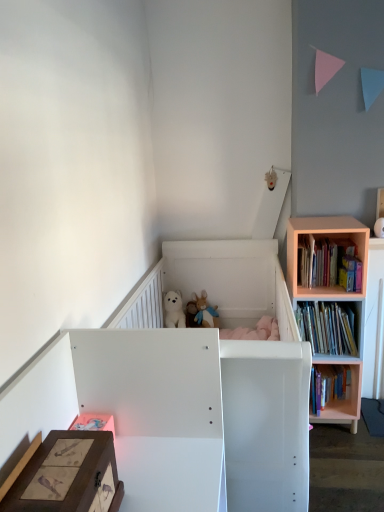
Question: Does matte white vase at upper right, which is the 1th toy from right to left, have a greater width compared to hardcover book at right, the 1th book from the bottom?

Choices:
 (A) yes
 (B) no

Answer: (B)

Question: Is matte white vase at upper right, the first toy from the front, shorter than hardcover book at right, arranged as the third book when viewed from the top?

Choices:
 (A) yes
 (B) no

Answer: (A)

Question: Is matte white vase at upper right, which ranks as the 1th toy in top-to-bottom order, not near hardcover book at right, the 1th book from the bottom?

Choices:
 (A) yes
 (B) no

Answer: (B)

Question: Is matte white vase at upper right, which ranks as the 1th toy in top-to-bottom order, outside of hardcover book at right, the 1th book from the bottom?

Choices:
 (A) no
 (B) yes

Answer: (B)

Question: From the image's perspective, is matte white vase at upper right, positioned as the second toy in bottom-to-top order, below hardcover book at right, arranged as the third book when viewed from the top?

Choices:
 (A) yes
 (B) no

Answer: (B)

Question: Is white matte infant bed at center in front of or behind white plush bear at upper center in the image?

Choices:
 (A) front
 (B) behind

Answer: (A)

Question: Looking at their shapes, would you say white matte infant bed at center is wider or thinner than white plush bear at upper center?

Choices:
 (A) thin
 (B) wide

Answer: (B)

Question: Visually, is white matte infant bed at center positioned to the left or to the right of white plush bear at upper center?

Choices:
 (A) left
 (B) right

Answer: (B)

Question: From a real-world perspective, relative to white plush bear at upper center, is white matte infant bed at center vertically above or below?

Choices:
 (A) below
 (B) above

Answer: (A)

Question: Relative to matte white vase at upper right, which is the 1th toy from right to left, is wooden storage box at lower left in front or behind?

Choices:
 (A) front
 (B) behind

Answer: (A)

Question: From the image's perspective, is wooden storage box at lower left positioned above or below matte white vase at upper right, which ranks as the 1th toy in top-to-bottom order?

Choices:
 (A) above
 (B) below

Answer: (B)

Question: Visually, is wooden storage box at lower left positioned to the left or to the right of matte white vase at upper right, marked as the second toy in a left-to-right arrangement?

Choices:
 (A) left
 (B) right

Answer: (A)

Question: Looking at their shapes, would you say wooden storage box at lower left is wider or thinner than matte white vase at upper right, the first toy from the front?

Choices:
 (A) thin
 (B) wide

Answer: (B)

Question: From the image's perspective, is wooden storage box at lower left above or below hardcover book at right, the 1th book from the bottom?

Choices:
 (A) below
 (B) above

Answer: (B)

Question: In terms of height, does wooden storage box at lower left look taller or shorter compared to hardcover book at right, the 1th book from the bottom?

Choices:
 (A) short
 (B) tall

Answer: (A)